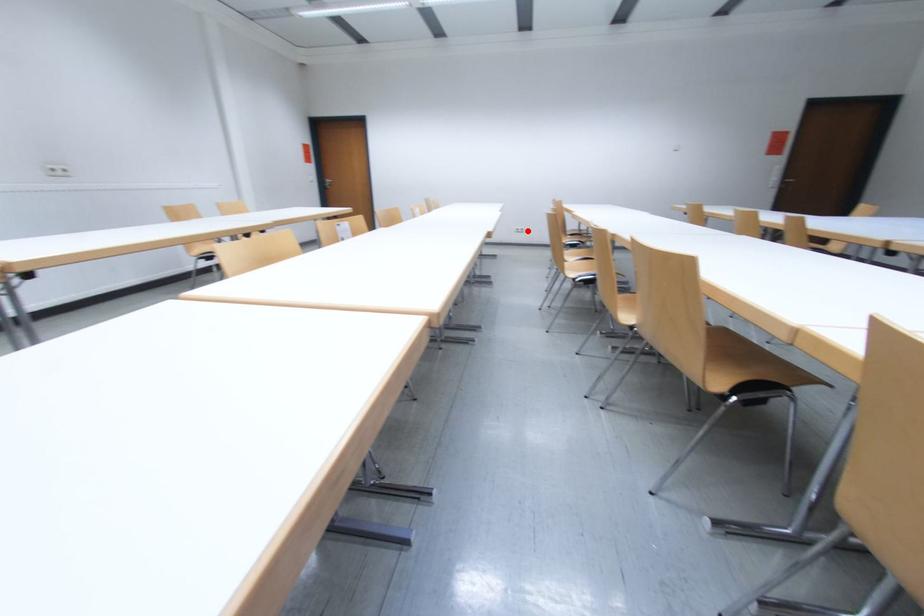
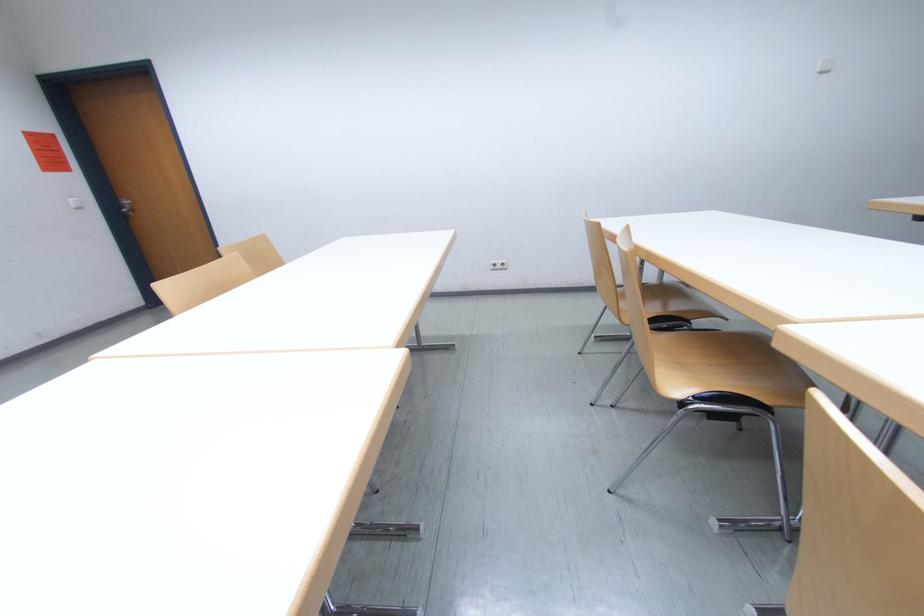
In the second image, find the point that corresponds to the highlighted location in the first image.

(505, 265)